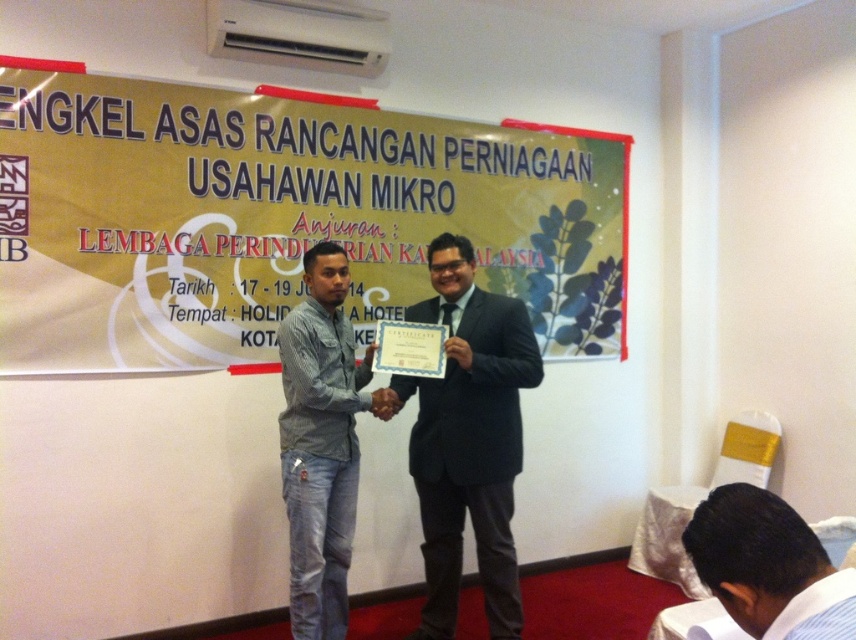
You are an event organizer setting up for a presentation. You have a yellow paperboard at upper center and blue denim jeans at lower left. Which object is shorter in height?

The yellow paperboard at upper center is shorter in height than the blue denim jeans at lower left because the yellow paperboard at upper center is not as tall as blue denim jeans at lower left.

What is located at point (278, 218)?

The yellow paperboard at upper center is located at point (278, 218).